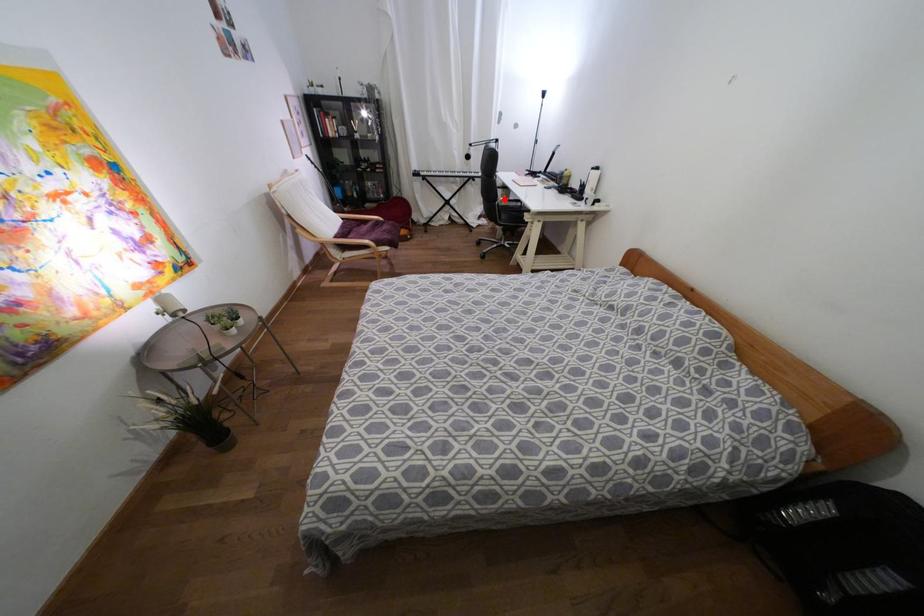
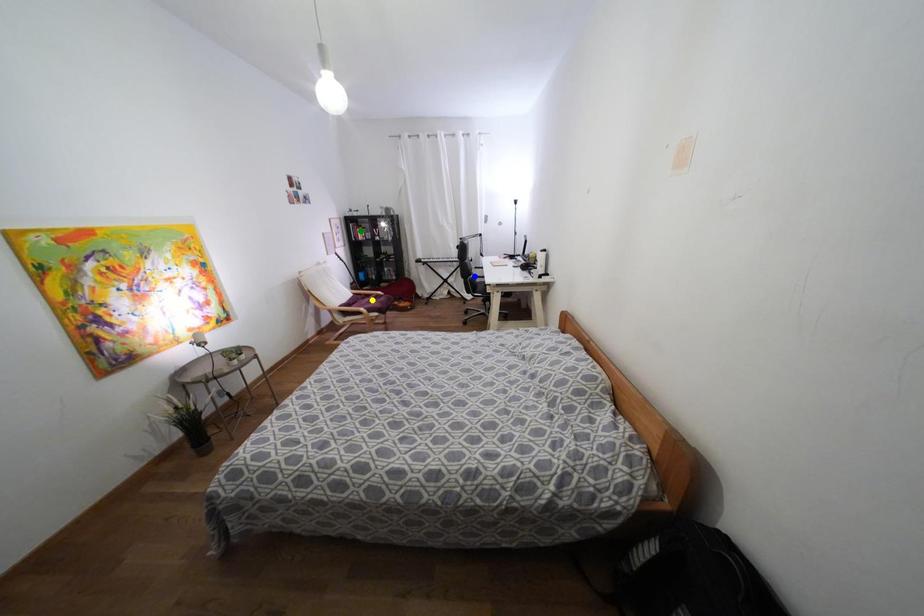
Question: I am providing you with two images of the same scene from different viewpoints. A red point is marked on the first image. You are given multiple points on the second image. Which point in image 2 represents the same 3d spot as the red point in image 1?

Choices:
 (A) blue point
 (B) yellow point
 (C) green point

Answer: (A)